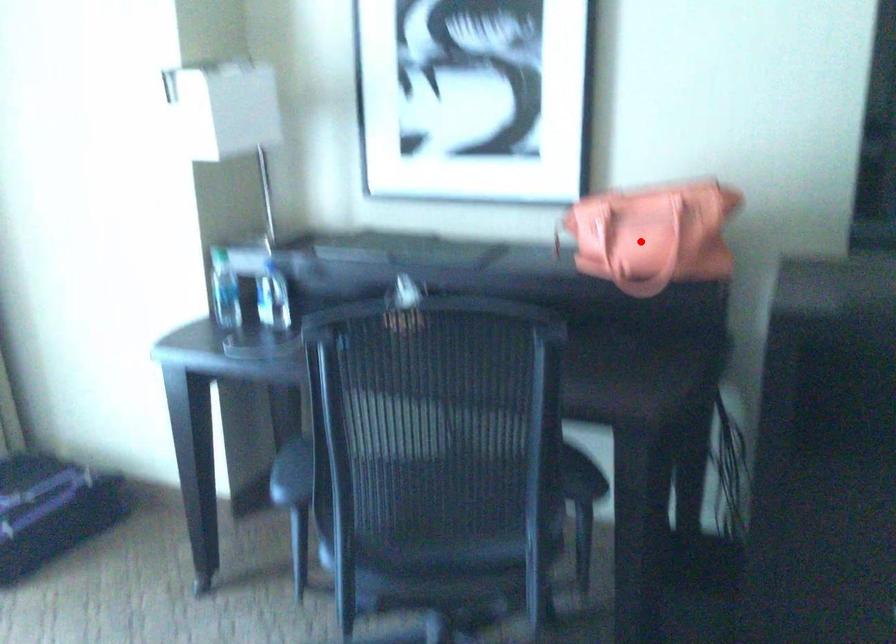
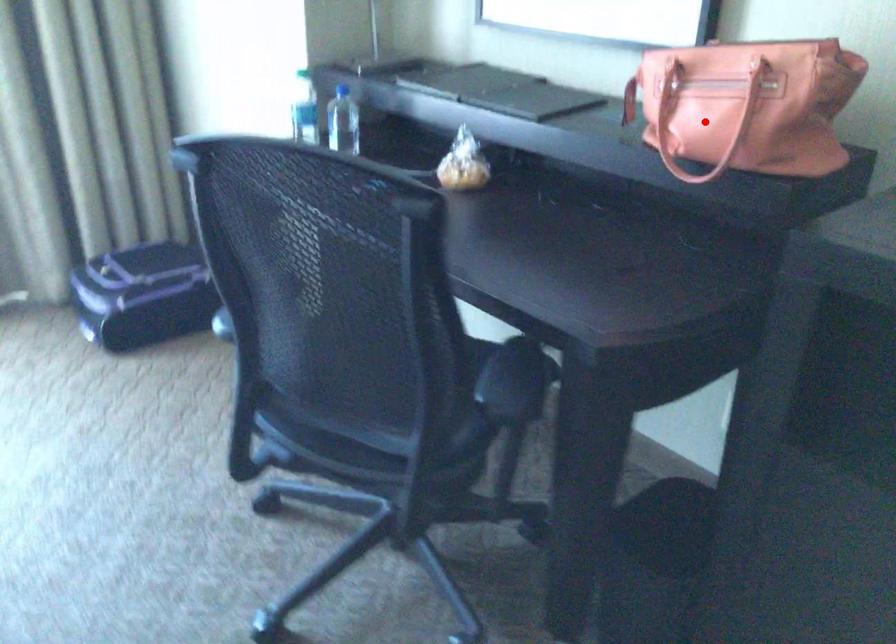
I am providing you with two images of the same scene from different viewpoints. A red point is marked on the first image and another point is marked on the second image. Are the points marked in image1 and image2 representing the same 3D position?

Yes